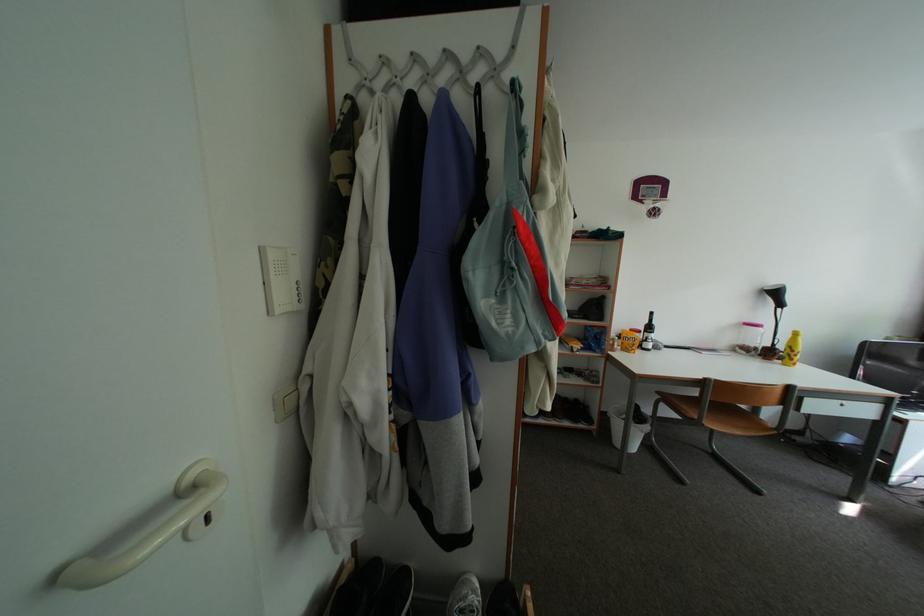
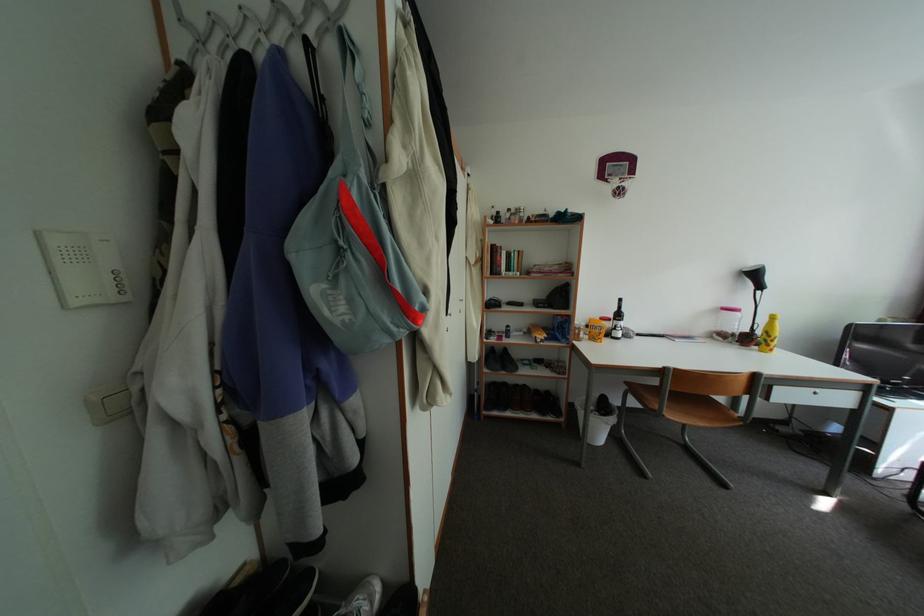
Question: The first image is from the beginning of the video and the second image is from the end. How did the camera likely rotate when shooting the video?

Choices:
 (A) Left
 (B) Right
 (C) Up
 (D) Down

Answer: (A)